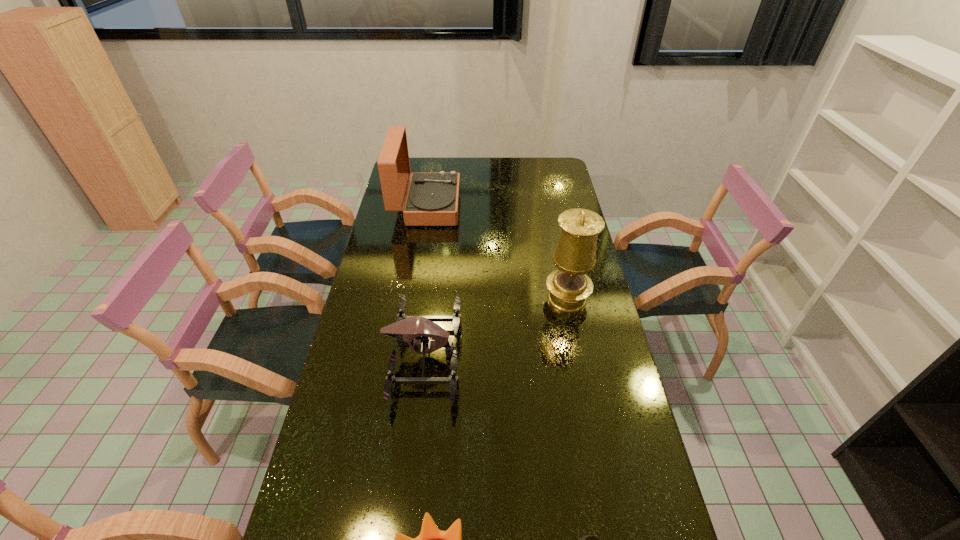
At what (x,y) coordinates should I click in order to perform the action: click on the tallest object. Please return your answer as a coordinate pair (x, y). The image size is (960, 540). Looking at the image, I should click on (569, 287).

Image resolution: width=960 pixels, height=540 pixels. I want to click on phonograph record, so click(x=432, y=199).

Locate an element on the screen. the second tallest object is located at coordinates (432, 199).

What are the coordinates of `drone` in the screenshot? It's located at (409, 331).

This screenshot has height=540, width=960. I want to click on vacant area situated on the left of the tallest object, so click(461, 298).

Where is `blank space located 0.070m on the face of the phonograph record`? This screenshot has width=960, height=540. blank space located 0.070m on the face of the phonograph record is located at coordinates (475, 206).

Locate an element on the screen. The width and height of the screenshot is (960, 540). blank space located 0.060m on the front-facing side of the drone is located at coordinates (480, 355).

The height and width of the screenshot is (540, 960). I want to click on phonograph record that is at the left edge, so click(432, 199).

I want to click on drone situated at the left edge, so click(409, 331).

I want to click on object located at the right edge, so click(569, 287).